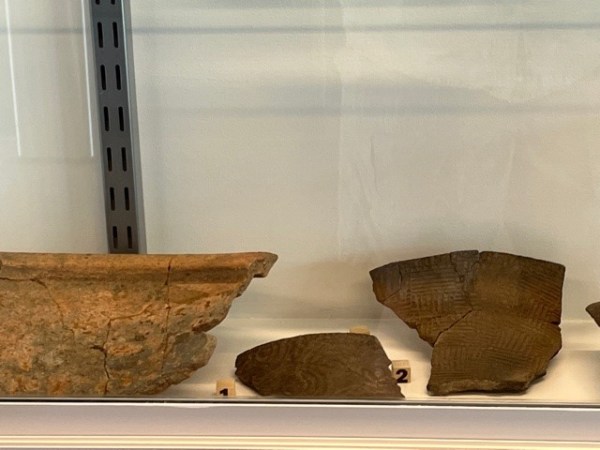
What are the coordinates of `floor` in the screenshot? It's located at (562, 386).